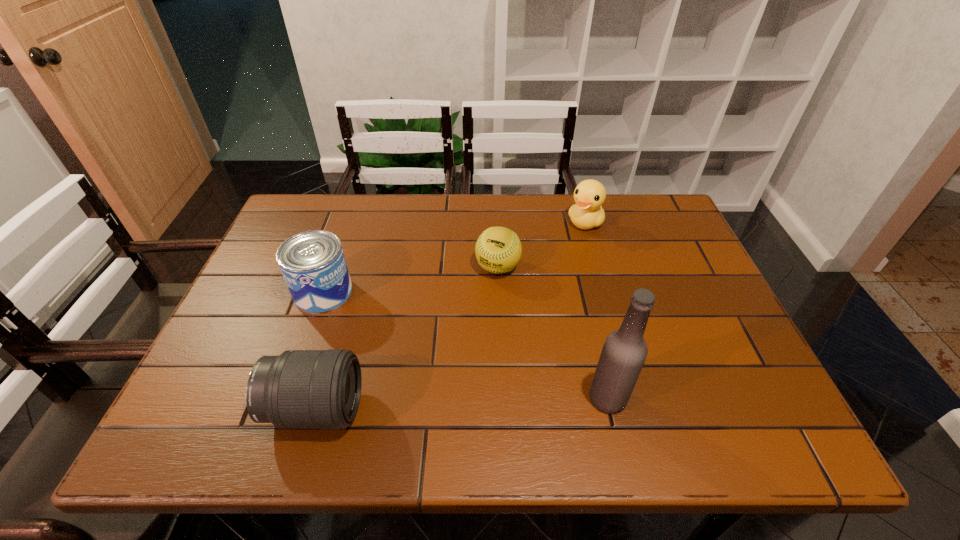
Where is `free spot located on the face of the duck`? This screenshot has height=540, width=960. free spot located on the face of the duck is located at coordinates (524, 301).

You are a GUI agent. You are given a task and a screenshot of the screen. Output one action in this format:
    pyautogui.click(x=<x>, y=<y>)
    Task: Click on the free space located on the face of the duck
    This screenshot has height=540, width=960.
    Given the screenshot: What is the action you would take?
    pyautogui.click(x=548, y=271)

Identify the location of vacant space located 0.190m on the face of the duck. The width and height of the screenshot is (960, 540). (548, 271).

The image size is (960, 540). Find the location of `vacant space located on the front label of the can`. vacant space located on the front label of the can is located at coordinates (409, 374).

In order to click on blank space located 0.110m on the front label of the can in this screenshot , I will do `click(365, 333)`.

Find the location of a particular element. The width and height of the screenshot is (960, 540). free spot located on the front label of the can is located at coordinates click(x=403, y=369).

In order to click on object at the far edge in this screenshot , I will do `click(589, 195)`.

Locate an element on the screen. The image size is (960, 540). telephoto lens at the near edge is located at coordinates (300, 389).

At what (x,y) coordinates should I click in order to perform the action: click on beer bottle located in the near edge section of the desktop. Please return your answer as a coordinate pair (x, y). Image resolution: width=960 pixels, height=540 pixels. Looking at the image, I should click on (624, 352).

Where is `object at the left edge`? The height and width of the screenshot is (540, 960). object at the left edge is located at coordinates click(x=313, y=265).